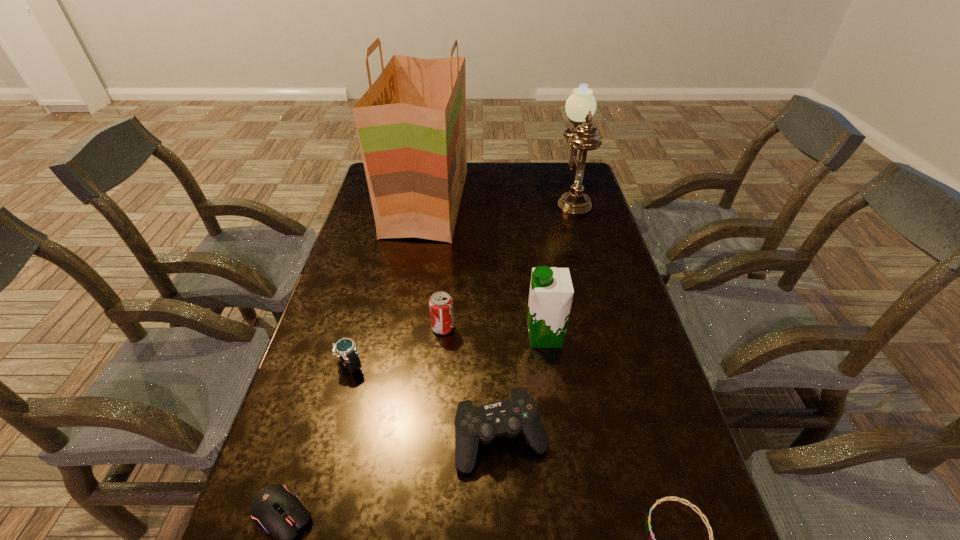
Locate which object ranks third in proximity to the computer mouse. Please provide its 2D coordinates. Your answer should be formatted as a tuple, i.e. [(x, y)], where the tuple contains the x and y coordinates of a point satisfying the conditions above.

[(440, 303)]

Point out which object is positioned as the fifth nearest to the bracelet. Please provide its 2D coordinates. Your answer should be formatted as a tuple, i.e. [(x, y)], where the tuple contains the x and y coordinates of a point satisfying the conditions above.

[(344, 348)]